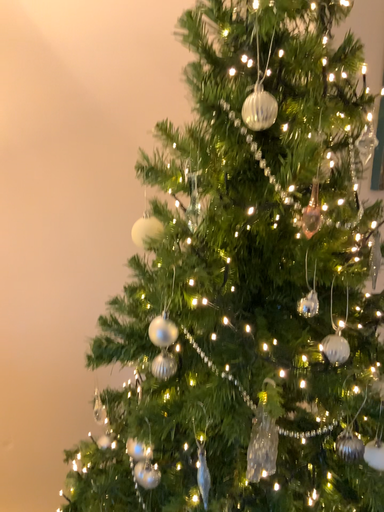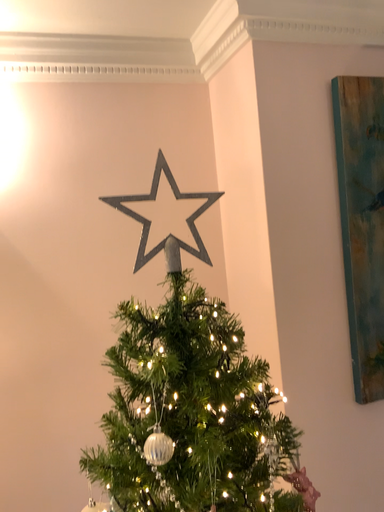
Question: Which way did the camera rotate in the video?

Choices:
 (A) rotated right
 (B) rotated left

Answer: (B)